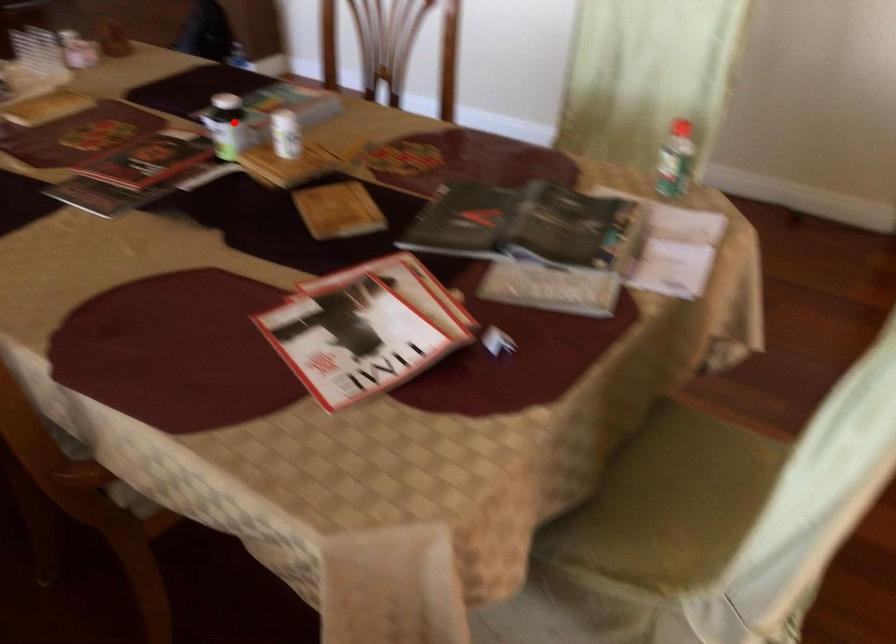
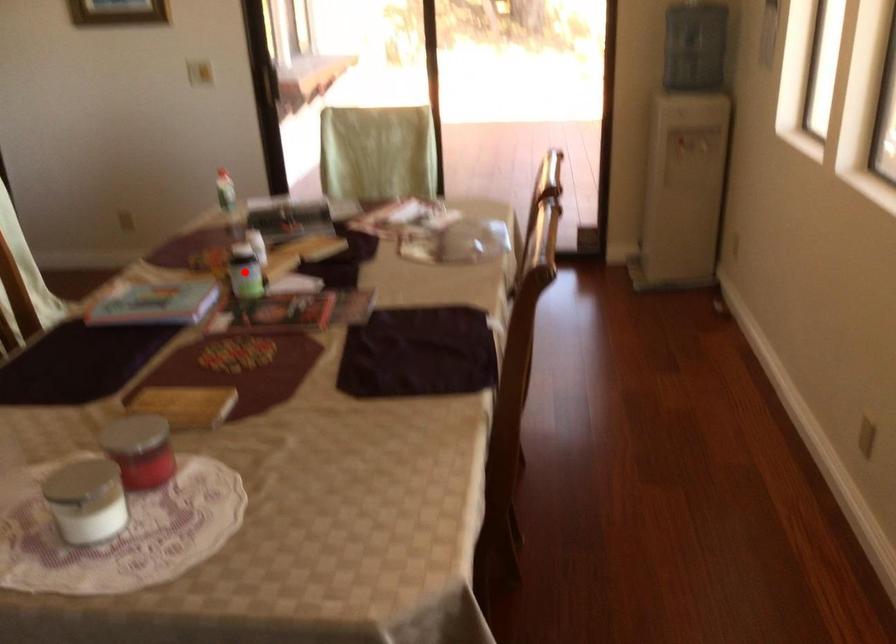
I am providing you with two images of the same scene from different viewpoints. A red point is marked on the first image and another point is marked on the second image. Are the points marked in image1 and image2 representing the same 3D position?

Yes